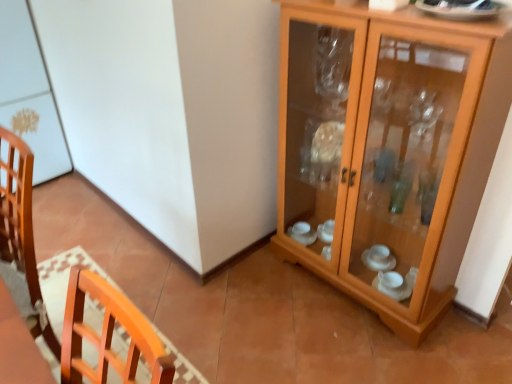
In order to click on vacant space to the left of wooden cabinet at right in this screenshot , I will do click(x=253, y=300).